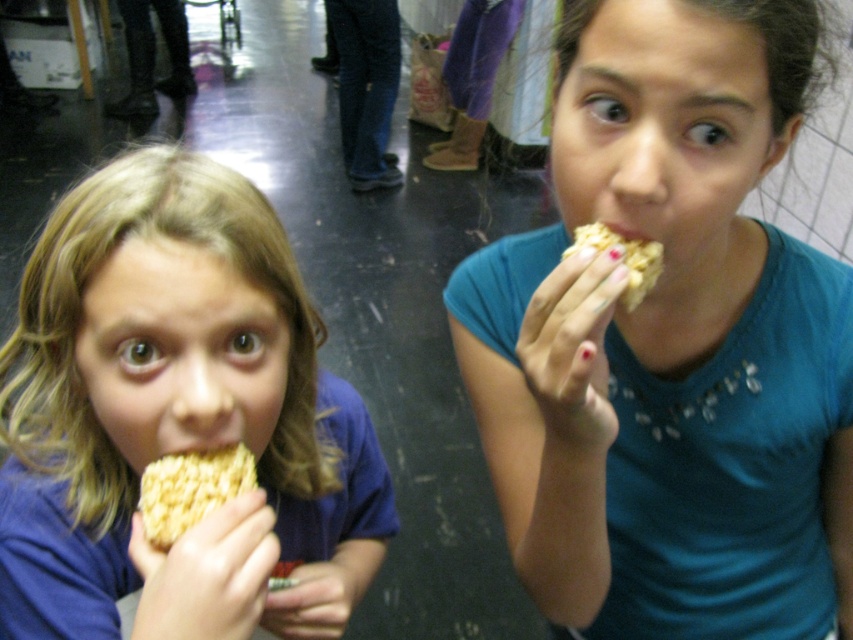
Is yellow crumbly snack at lower left behind yellow crumbly snack at upper right?

Yes, yellow crumbly snack at lower left is behind yellow crumbly snack at upper right.

Find the location of a particular element. The width and height of the screenshot is (853, 640). yellow crumbly snack at lower left is located at coordinates (190, 490).

Between matte yellow rice krispie treat at center and yellow crumbly snack at upper right, which one is positioned higher?

yellow crumbly snack at upper right is higher up.

Can you confirm if matte yellow rice krispie treat at center is positioned below yellow crumbly snack at upper right?

Correct, matte yellow rice krispie treat at center is located below yellow crumbly snack at upper right.

The width and height of the screenshot is (853, 640). Identify the location of matte yellow rice krispie treat at center. (669, 342).

At what (x,y) coordinates should I click in order to perform the action: click on matte yellow rice krispie treat at center. Please return your answer as a coordinate pair (x, y). The image size is (853, 640). Looking at the image, I should click on (669, 342).

Measure the distance between point (784, 129) and camera.

Point (784, 129) is 21.31 inches from camera.

Does matte yellow rice krispie treat at center lie in front of matte yellow rice krispie treat at left?

No.

What do you see at coordinates (669, 342) in the screenshot? I see `matte yellow rice krispie treat at center` at bounding box center [669, 342].

Find the location of `matte yellow rice krispie treat at center`. matte yellow rice krispie treat at center is located at coordinates (669, 342).